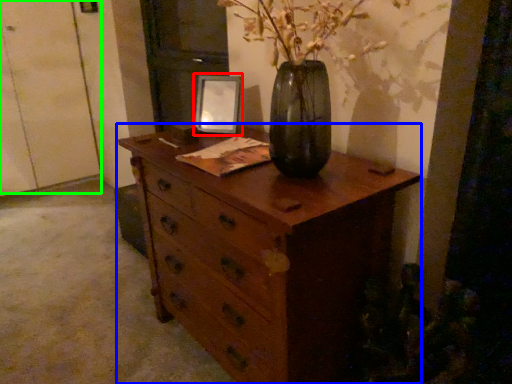
Question: Which is nearer to the picture frame (highlighted by a red box)? chest of drawers (highlighted by a blue box) or door (highlighted by a green box).

Choices:
 (A) chest of drawers
 (B) door

Answer: (A)